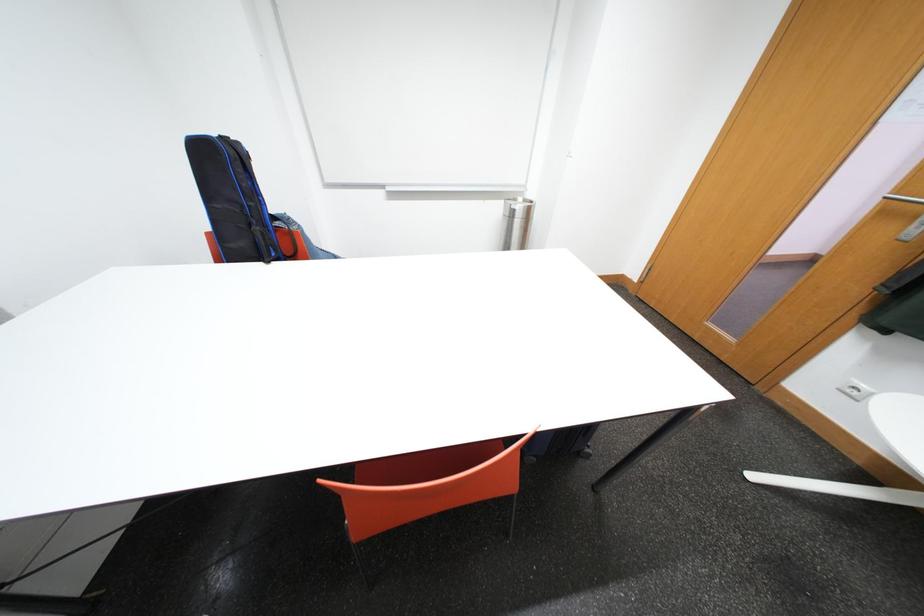
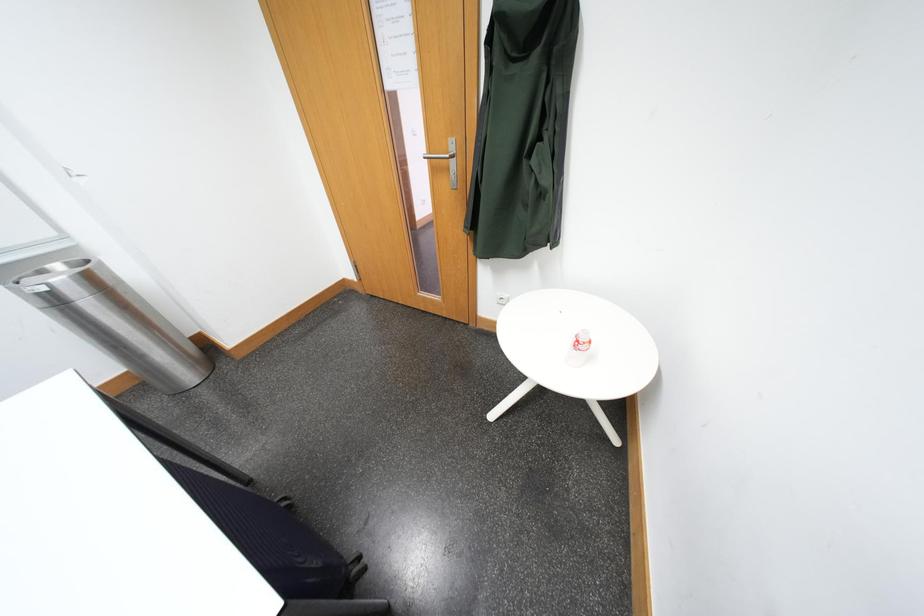
Question: The camera is either moving clockwise (left) or counter-clockwise (right) around the object. The first image is from the beginning of the video and the second image is from the end. Is the camera moving left or right when shooting the video?

Choices:
 (A) Left
 (B) Right

Answer: (A)